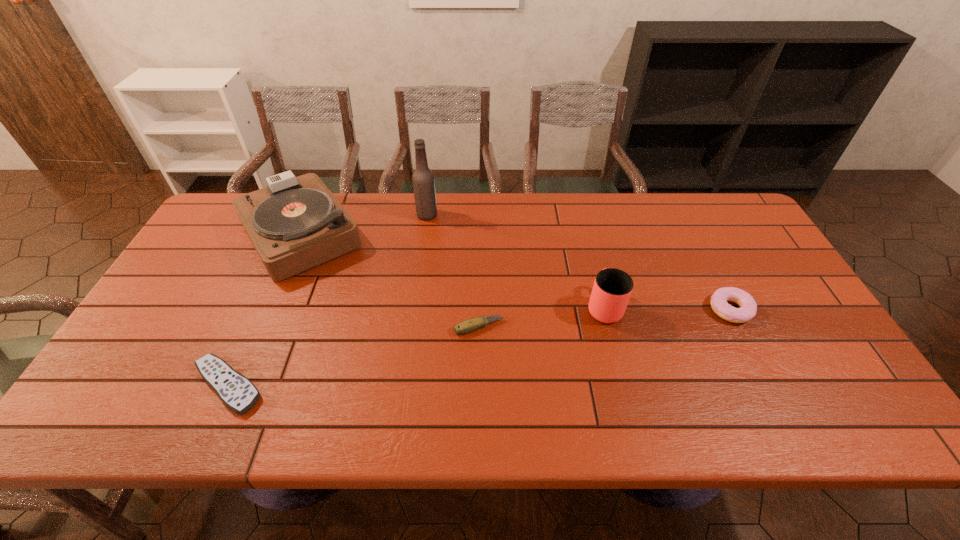
Identify the location of beer bottle. (423, 181).

You are a GUI agent. You are given a task and a screenshot of the screen. Output one action in this format:
    pyautogui.click(x=<x>, y=<y>)
    Task: Click on the tallest object
    The image size is (960, 540).
    Given the screenshot: What is the action you would take?
    pyautogui.click(x=423, y=181)

This screenshot has width=960, height=540. I want to click on record player, so click(295, 223).

This screenshot has height=540, width=960. I want to click on the second object from right to left, so click(612, 288).

Where is `doughnut`? The height and width of the screenshot is (540, 960). doughnut is located at coordinates 748,307.

Identify the location of the rightmost object. This screenshot has height=540, width=960. (748, 307).

Locate an element on the screen. This screenshot has height=540, width=960. pocketknife is located at coordinates (473, 324).

Locate an element on the screen. This screenshot has height=540, width=960. the nearest object is located at coordinates (237, 392).

Locate an element on the screen. This screenshot has height=540, width=960. free space located on the side of the third object from left to right with the label is located at coordinates (483, 215).

Locate an element on the screen. Image resolution: width=960 pixels, height=540 pixels. vacant space located on the left of the record player is located at coordinates (213, 234).